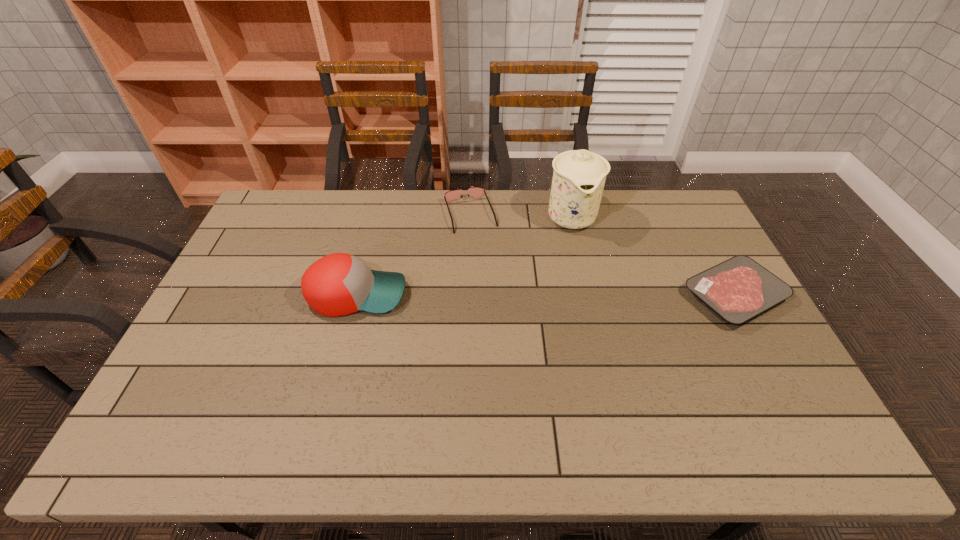
Locate an element on the screen. Image resolution: width=960 pixels, height=540 pixels. empty space between the shortest object and the third tallest object is located at coordinates (602, 255).

In order to click on free spot between the sunglasses and the tallest object in this screenshot , I will do `click(520, 215)`.

The width and height of the screenshot is (960, 540). I want to click on vacant space that's between the tallest object and the second object from left to right, so click(520, 215).

Locate an element on the screen. Image resolution: width=960 pixels, height=540 pixels. free space between the chinaware and the sunglasses is located at coordinates 520,215.

The image size is (960, 540). I want to click on vacant area that lies between the baseball cap and the sunglasses, so click(x=414, y=254).

Identify the location of the third closest object to the second object from left to right. (738, 289).

Locate which object is the second closest to the rightmost object. Please provide its 2D coordinates. Your answer should be formatted as a tuple, i.e. [(x, y)], where the tuple contains the x and y coordinates of a point satisfying the conditions above.

[(476, 192)]

You are a GUI agent. You are given a task and a screenshot of the screen. Output one action in this format:
    pyautogui.click(x=<x>, y=<y>)
    Task: Click on the free space that satisfies the following two spatial constraints: 1. on the front side of the shortest object; 2. on the left side of the tallest object
    
    Given the screenshot: What is the action you would take?
    pyautogui.click(x=588, y=295)